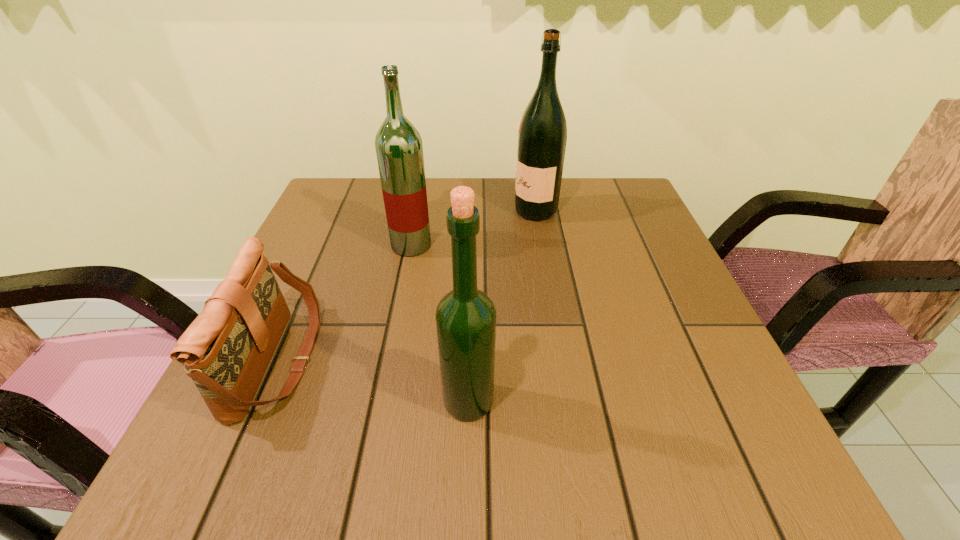
The width and height of the screenshot is (960, 540). In order to click on vacant space at the left edge of the desktop in this screenshot , I will do `click(321, 265)`.

Find the location of `free space at the right edge`. free space at the right edge is located at coordinates (660, 343).

In the image, there is a desktop. Where is `vacant area at the far left corner`? This screenshot has width=960, height=540. vacant area at the far left corner is located at coordinates (363, 203).

In the image, there is a desktop. Where is `blank space at the far right corner`? The image size is (960, 540). blank space at the far right corner is located at coordinates (583, 202).

The height and width of the screenshot is (540, 960). What are the coordinates of `vacant space at the near right corner` in the screenshot? It's located at coord(686,435).

This screenshot has height=540, width=960. I want to click on free space between the nearest liquor and the shortest object, so (373, 381).

The height and width of the screenshot is (540, 960). I want to click on free space that is in between the shoulder bag and the nearest liquor, so click(x=373, y=381).

At what (x,y) coordinates should I click in order to perform the action: click on vacant area between the shoulder bag and the rightmost liquor. Please return your answer as a coordinate pair (x, y). This screenshot has width=960, height=540. Looking at the image, I should click on (407, 286).

You are a GUI agent. You are given a task and a screenshot of the screen. Output one action in this format:
    pyautogui.click(x=<x>, y=<y>)
    Task: Click on the empty location between the nearest liquor and the farthest object
    The width and height of the screenshot is (960, 540).
    Given the screenshot: What is the action you would take?
    pyautogui.click(x=502, y=306)

In order to click on vacant area that lies between the second object from right to left and the shortest object in this screenshot , I will do `click(373, 381)`.